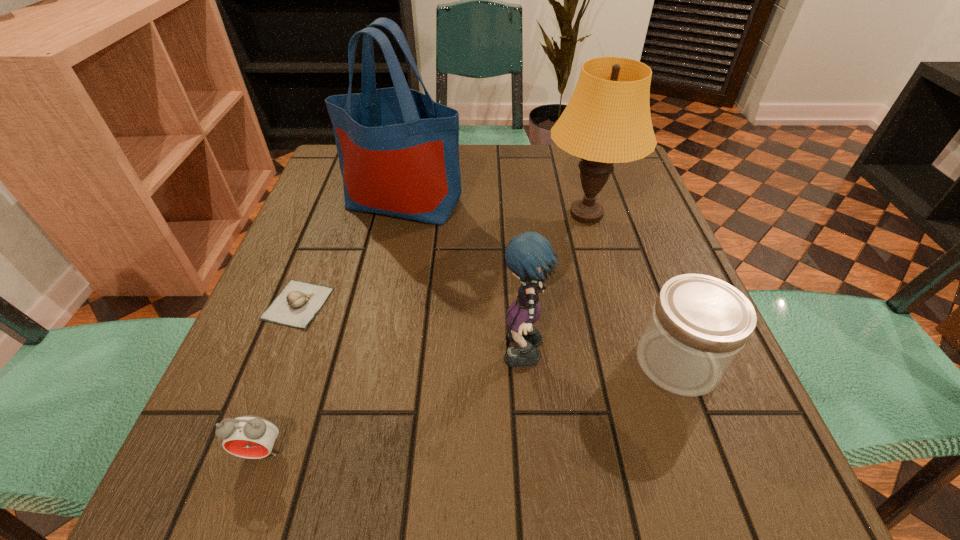
This screenshot has height=540, width=960. In order to click on vacant position located 0.140m on the front-facing side of the third tallest object in this screenshot , I will do [419, 356].

Where is `vacant space situated 0.260m on the front-facing side of the third tallest object`? The image size is (960, 540). vacant space situated 0.260m on the front-facing side of the third tallest object is located at coordinates (349, 356).

I want to click on vacant point located 0.400m on the front-facing side of the third tallest object, so click(x=268, y=356).

In order to click on free spot located on the left of the jar in this screenshot , I will do `click(537, 362)`.

Image resolution: width=960 pixels, height=540 pixels. Identify the location of vacant space located 0.260m on the front of the shortest object. (230, 478).

Locate an element on the screen. Image resolution: width=960 pixels, height=540 pixels. handbag located in the far edge section of the desktop is located at coordinates (398, 150).

Find the location of `lampshade that is at the far edge`. lampshade that is at the far edge is located at coordinates (607, 120).

Where is `object that is at the near edge`? This screenshot has height=540, width=960. object that is at the near edge is located at coordinates (247, 436).

Image resolution: width=960 pixels, height=540 pixels. I want to click on handbag at the left edge, so click(398, 150).

Locate an element on the screen. The image size is (960, 540). alarm clock situated at the left edge is located at coordinates (247, 436).